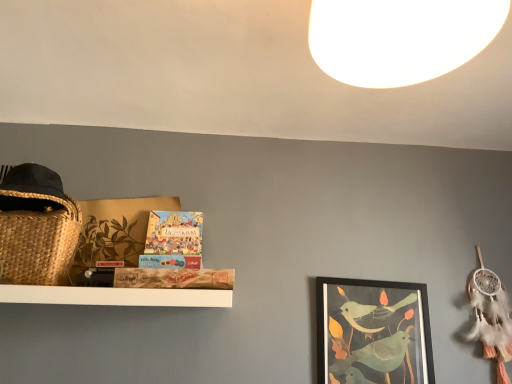
Locate an element on the screen. The height and width of the screenshot is (384, 512). matte black picture frame at center right is located at coordinates (373, 332).

Find the location of `white matte light at upper center`. white matte light at upper center is located at coordinates (399, 38).

The image size is (512, 384). There is a matte board game at center. Identify the location of light above it (from a real-world perspective). (399, 38).

Is point (150, 267) positioned before point (408, 26)?

No, (150, 267) is further to viewer.

Is matte board game at center in front of or behind white matte light at upper center in the image?

matte board game at center is positioned farther from the viewer than white matte light at upper center.

Considering the relative sizes of matte board game at center and white matte light at upper center in the image provided, is matte board game at center bigger than white matte light at upper center?

No, matte board game at center is not bigger than white matte light at upper center.

Is white matte light at upper center positioned with its back to matte board game at center?

Yes, matte board game at center is at the back of white matte light at upper center.

In the scene shown: Is white matte light at upper center bigger or smaller than matte board game at center?

white matte light at upper center is bigger than matte board game at center.

Does white matte light at upper center come in front of matte board game at center?

Yes, the depth of white matte light at upper center is less than that of matte board game at center.

Could you tell me if matte board game at center is turned towards matte black picture frame at center right?

No, matte board game at center is not aimed at matte black picture frame at center right.

Considering the relative sizes of matte board game at center and matte black picture frame at center right in the image provided, is matte board game at center smaller than matte black picture frame at center right?

Correct, matte board game at center occupies less space than matte black picture frame at center right.

From the image's perspective, is matte board game at center above matte black picture frame at center right?

Indeed, from the image's perspective, matte board game at center is shown above matte black picture frame at center right.

Is matte black picture frame at center right in contact with matte board game at center?

No.

From the image's perspective, between matte black picture frame at center right and matte board game at center, which one is located above?

matte board game at center appears higher in the image.

Locate an element on the screen. The height and width of the screenshot is (384, 512). book that appears in front of the matte black picture frame at center right is located at coordinates (173, 240).

Between white matte light at upper center and matte black picture frame at center right, which one appears on the left side from the viewer's perspective?

white matte light at upper center is more to the left.

How distant is white matte light at upper center from matte black picture frame at center right?

The distance of white matte light at upper center from matte black picture frame at center right is 3.55 feet.

Who is shorter, white matte light at upper center or matte black picture frame at center right?

white matte light at upper center.

Is white matte light at upper center oriented away from matte black picture frame at center right?

Yes, white matte light at upper center is positioned with its back facing matte black picture frame at center right.

Considering the relative sizes of matte black picture frame at center right and white matte light at upper center in the image provided, is matte black picture frame at center right shorter than white matte light at upper center?

No, matte black picture frame at center right is not shorter than white matte light at upper center.

In the scene shown: Is matte black picture frame at center right touching white matte light at upper center?

No, matte black picture frame at center right is not beside white matte light at upper center.

How many degrees apart are the facing directions of matte black picture frame at center right and white matte light at upper center?

They differ by 4.04 degrees in their facing directions.

Does matte black picture frame at center right have a smaller size compared to white matte light at upper center?

Yes, matte black picture frame at center right is smaller than white matte light at upper center.

The height and width of the screenshot is (384, 512). What are the coordinates of `light above the matte board game at center (from a real-world perspective)` in the screenshot? It's located at (399, 38).

Locate an element on the screen. The width and height of the screenshot is (512, 384). light on the right of the matte board game at center is located at coordinates (x=399, y=38).

Estimate the real-world distances between objects in this image. Which object is closer to matte black picture frame at center right, white matte light at upper center or matte board game at center?

matte board game at center lies closer to matte black picture frame at center right than the other object.

Based on their spatial positions, is matte board game at center or matte black picture frame at center right further from white matte light at upper center?

matte black picture frame at center right is positioned further to the anchor white matte light at upper center.

From the image, which object appears to be farther from matte board game at center, white matte light at upper center or matte black picture frame at center right?

white matte light at upper center is positioned further to the anchor matte board game at center.

Based on their spatial positions, is matte black picture frame at center right or matte board game at center closer to white matte light at upper center?

matte board game at center.

From the image, which object appears to be nearer to matte board game at center, matte black picture frame at center right or white matte light at upper center?

matte black picture frame at center right.

Looking at the image, which one is located closer to matte black picture frame at center right, matte board game at center or white matte light at upper center?

matte board game at center is positioned closer to the anchor matte black picture frame at center right.

The width and height of the screenshot is (512, 384). I want to click on book between white matte light at upper center and matte black picture frame at center right from front to back, so click(173, 240).